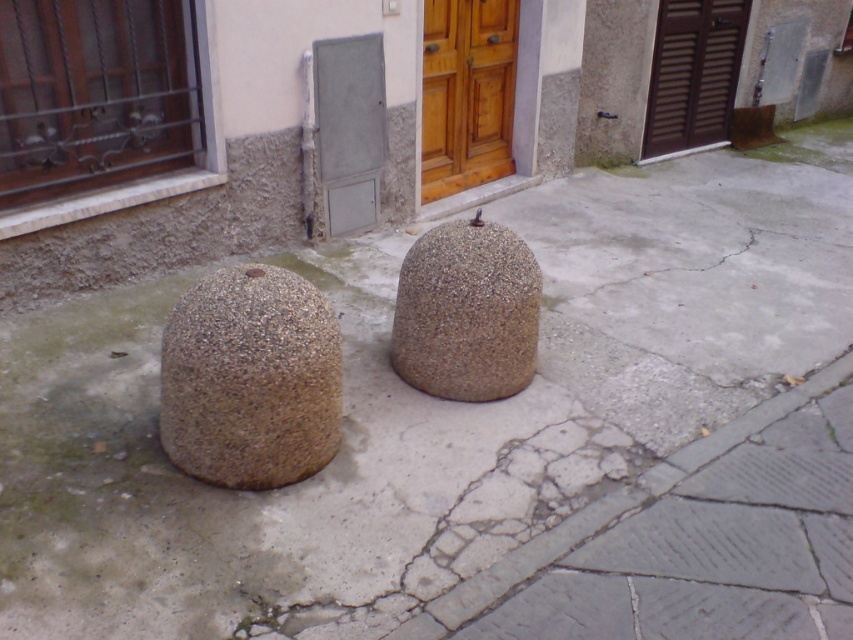
You are a delivery person trying to park your bike between the two granular stone boulders. The bike requires at least 1 meter of space to fit. Based on the scene, can you determine if there is enough space between the granular stone boulder at lower left and the granular stone boulder at center?

The granular stone boulder at lower left has a greater height compared to the granular stone boulder at center, but the description does not provide information about the distance between them. Therefore, it is impossible to determine if there is enough space for the bike.

You are a delivery person trying to park a 1.2 meter wide cart between the granular stone boulder at lower left and the wooden at center. Based on the scene, will your cart fit in the space between them?

The granular stone boulder at lower left is wider than the wooden at center, but the description does not provide the exact distance between them. Therefore, it is uncertain if the 1.2 meter wide cart will fit between them.

You are a delivery person trying to navigate a narrow path between two granular stone boulders. The path is only 1 meter wide. Given the positions of the granular stone boulder at lower left and the granular stone boulder at center, can you pass through the space between them?

The granular stone boulder at lower left is to the left of the granular stone boulder at center. The distance between them is not specified, so it is uncertain whether the 1 meter wide path is sufficient for passage.